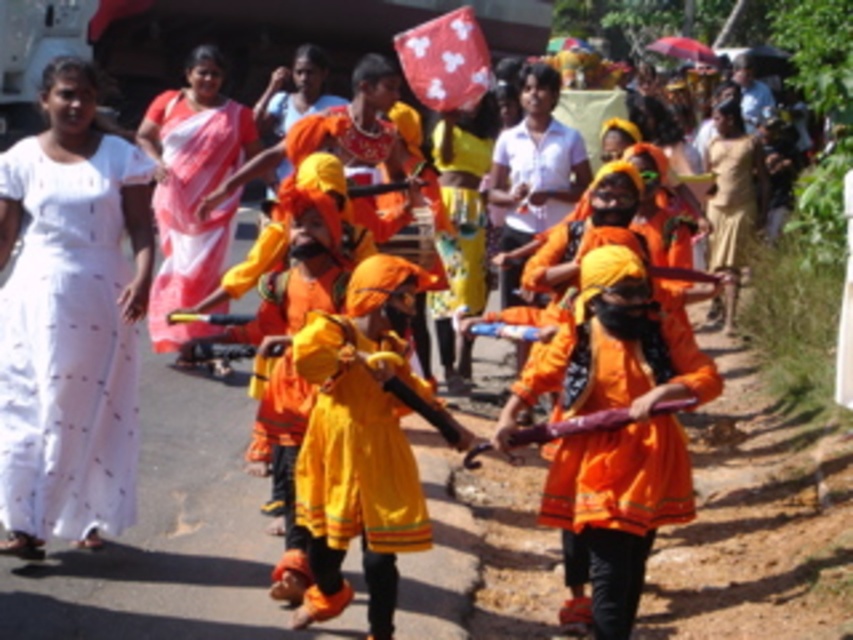
Does white silk saree at upper left appear on the left side of brown cotton saree at right?

Yes, white silk saree at upper left is to the left of brown cotton saree at right.

Who is more distant from viewer, (x=259, y=147) or (x=724, y=216)?

The point (x=724, y=216) is more distant.

This screenshot has height=640, width=853. Identify the location of white silk saree at upper left. (192, 188).

Based on the photo, which is more to the left, matte orange dress at center or brown cotton saree at right?

From the viewer's perspective, matte orange dress at center appears more on the left side.

Who is more distant from viewer, (396, 294) or (734, 305)?

The point (734, 305) is behind.

Between point (297, 353) and point (746, 170), which one is positioned in front?

Positioned in front is point (297, 353).

What are the coordinates of `matte orange dress at center` in the screenshot? It's located at (363, 442).

Who is positioned more to the left, white cotton dress at left or white silk saree at upper left?

Positioned to the left is white cotton dress at left.

Looking at this image, who is shorter, white cotton dress at left or white silk saree at upper left?

white silk saree at upper left

Does point (9, 392) come behind point (186, 122)?

No, it is not.

At what (x,y) coordinates should I click in order to perform the action: click on white cotton dress at left. Please return your answer as a coordinate pair (x, y). Looking at the image, I should click on (68, 321).